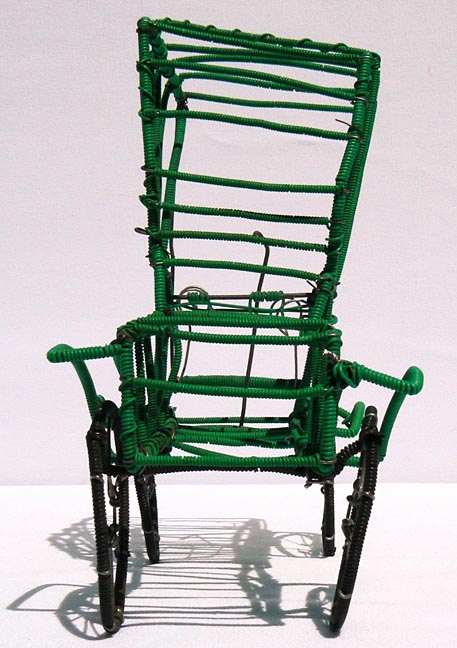
Where is `left vertical green caned bar on chair`? The height and width of the screenshot is (648, 457). left vertical green caned bar on chair is located at coordinates (147, 124).